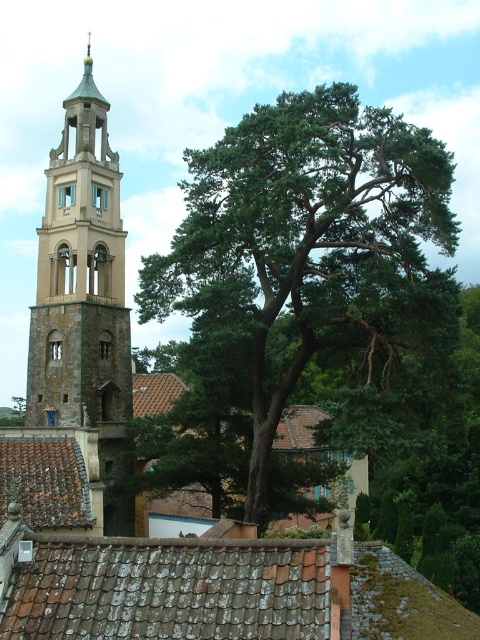
Question: Which of the following is the farthest from the observer?

Choices:
 (A) brown tile roof at lower center
 (B) brown tile roof at lower left
 (C) stone bell tower at left
 (D) green leafy tree at center

Answer: (C)

Question: Can you confirm if stone bell tower at left is wider than brown tile roof at lower left?

Choices:
 (A) no
 (B) yes

Answer: (B)

Question: Which object is closer to the camera taking this photo?

Choices:
 (A) brown tile roof at lower center
 (B) green leafy tree at center
 (C) stone bell tower at left
 (D) brown tile roof at lower left

Answer: (A)

Question: Which object is the closest to the green leafy tree at center?

Choices:
 (A) brown tile roof at lower center
 (B) brown tile roof at lower left
 (C) stone bell tower at left

Answer: (C)

Question: From the image, what is the correct spatial relationship of green leafy tree at center in relation to brown tile roof at lower center?

Choices:
 (A) below
 (B) above

Answer: (B)

Question: Can you confirm if brown tile roof at lower center is smaller than stone bell tower at left?

Choices:
 (A) yes
 (B) no

Answer: (A)